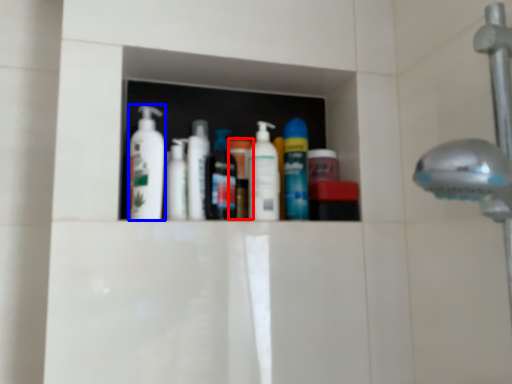
Question: Among these objects, which one is farthest to the camera, toiletry (highlighted by a red box) or cleaning product (highlighted by a blue box)?

Choices:
 (A) toiletry
 (B) cleaning product

Answer: (A)